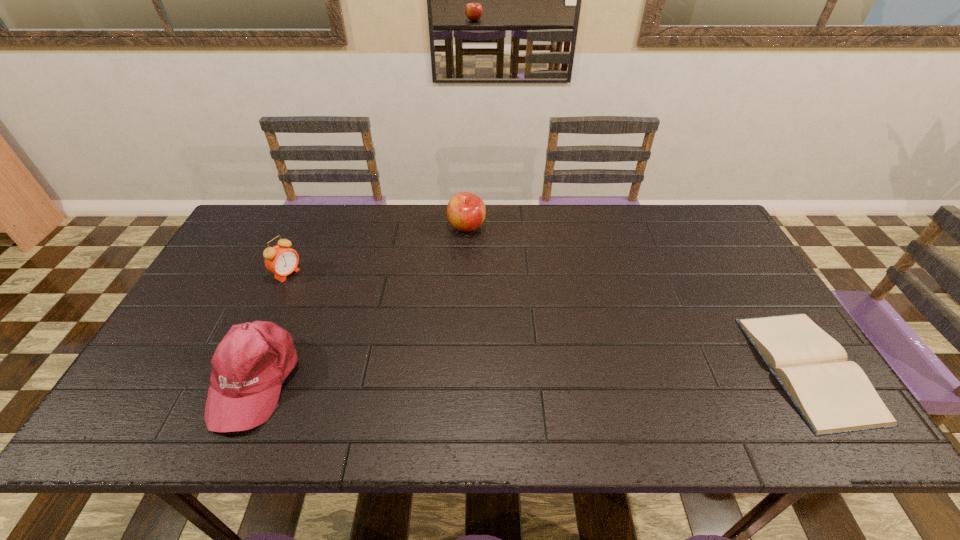
In order to click on empty space that is in between the third object from left to right and the baseball cap in this screenshot , I will do `click(361, 303)`.

The height and width of the screenshot is (540, 960). I want to click on vacant area between the second farthest object and the farthest object, so click(377, 250).

Image resolution: width=960 pixels, height=540 pixels. What are the coordinates of `vacant point located between the third object from left to right and the alarm clock` in the screenshot? It's located at (377, 250).

Where is `free space between the farthest object and the third nearest object`? Image resolution: width=960 pixels, height=540 pixels. free space between the farthest object and the third nearest object is located at coordinates (377, 250).

This screenshot has height=540, width=960. In order to click on empty location between the third nearest object and the shortest object in this screenshot , I will do `click(548, 321)`.

Where is `object that is the second closest to the alarm clock`? The width and height of the screenshot is (960, 540). object that is the second closest to the alarm clock is located at coordinates (466, 212).

Identify which object is located as the second nearest to the apple. Please provide its 2D coordinates. Your answer should be formatted as a tuple, i.e. [(x, y)], where the tuple contains the x and y coordinates of a point satisfying the conditions above.

[(249, 365)]

Where is `free space that satisfies the following two spatial constraints: 1. on the front side of the shortest object; 2. on the left side of the apple`? free space that satisfies the following two spatial constraints: 1. on the front side of the shortest object; 2. on the left side of the apple is located at coordinates (462, 368).

The height and width of the screenshot is (540, 960). Identify the location of free spot that satisfies the following two spatial constraints: 1. on the back side of the alarm clock; 2. on the right side of the apple. (309, 227).